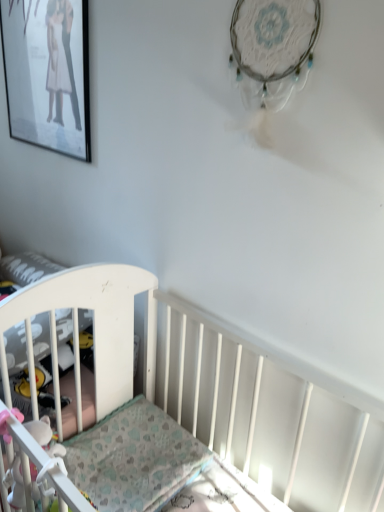
Question: From their relative heights in the image, would you say matte black picture frame at upper left is taller or shorter than white plastic crib at left?

Choices:
 (A) tall
 (B) short

Answer: (A)

Question: Is matte black picture frame at upper left wider or thinner than white plastic crib at left?

Choices:
 (A) thin
 (B) wide

Answer: (A)

Question: Based on their relative distances, which object is farther from the white fabric toy at lower left?

Choices:
 (A) patterned fabric mattress at lower left
 (B) matte black picture frame at upper left
 (C) white plastic crib at left

Answer: (B)

Question: Based on their relative distances, which object is farther from the patterned fabric mattress at lower left?

Choices:
 (A) white plastic crib at left
 (B) white fabric toy at lower left
 (C) matte black picture frame at upper left

Answer: (C)